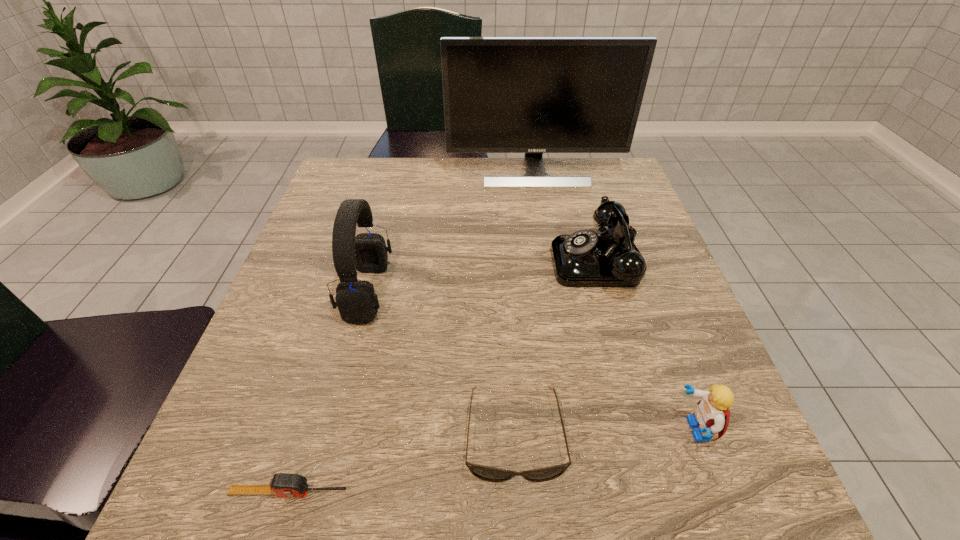
Find the location of `vacant space located on the dial of the telephone`. vacant space located on the dial of the telephone is located at coordinates (460, 261).

The height and width of the screenshot is (540, 960). Identify the location of free point located on the dial of the telephone. (404, 261).

The width and height of the screenshot is (960, 540). Identify the location of free space located on the front-facing side of the Lego. (624, 430).

At what (x,y) coordinates should I click in order to perform the action: click on vacant space located on the front-facing side of the Lego. Please return your answer as a coordinate pair (x, y). Image resolution: width=960 pixels, height=540 pixels. Looking at the image, I should click on (468, 430).

This screenshot has height=540, width=960. I want to click on vacant area located on the front-facing side of the Lego, so click(x=428, y=430).

The image size is (960, 540). I want to click on vacant space located on the back of the tape measure, so click(321, 386).

I want to click on object that is positioned at the far edge, so click(533, 95).

Find the location of a particular element. sunglasses at the near edge is located at coordinates (485, 473).

What are the coordinates of `tape measure located in the near edge section of the desktop` in the screenshot? It's located at (282, 484).

Find the location of `headset that is at the left edge`. headset that is at the left edge is located at coordinates (356, 300).